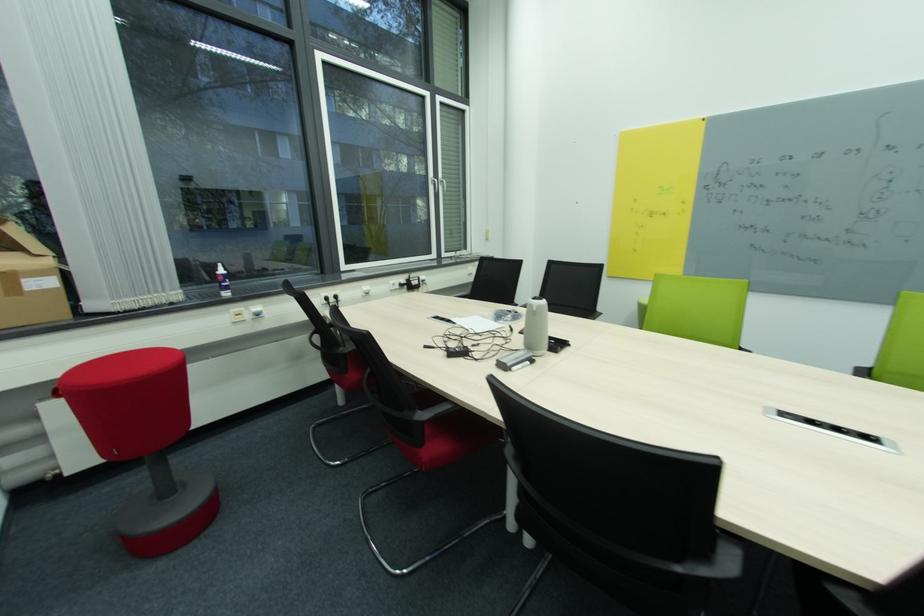
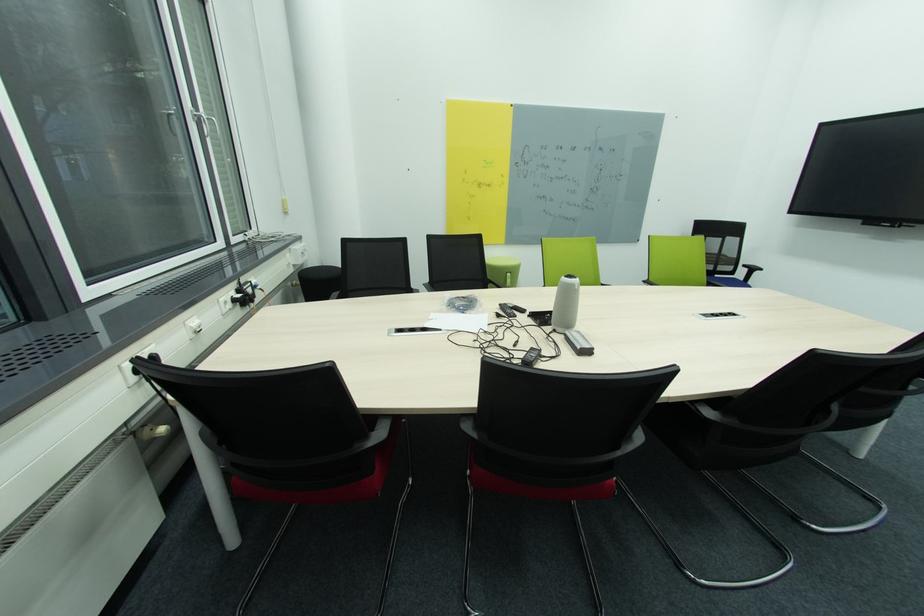
In the second image, find the point that corresponds to pixel 439 184 in the first image.

(201, 120)